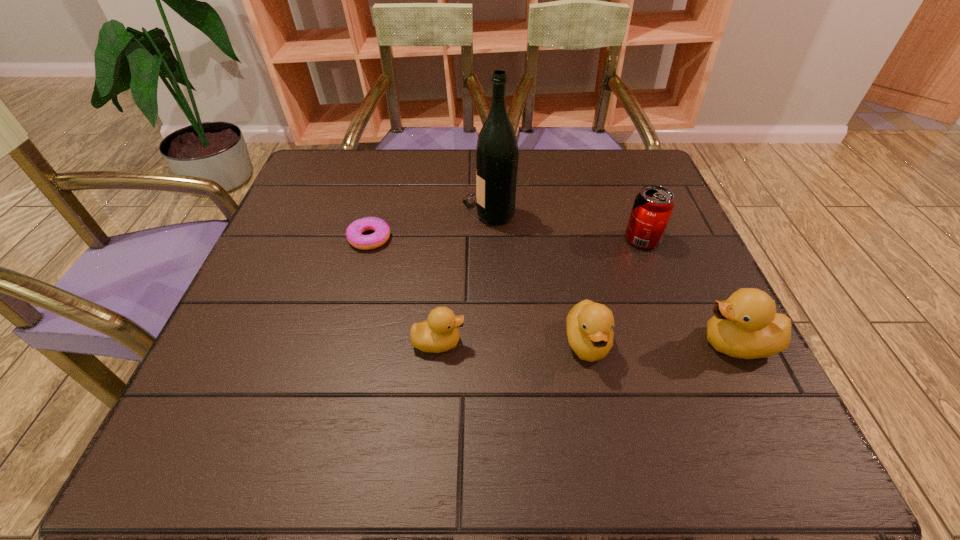
In the current image, all ducklings are evenly spaced. To maintain this equal spacing, where should an additional duckling be placed on the left? Please point out a free spot. Please provide its 2D coordinates. Your answer should be formatted as a tuple, i.e. [(x, y)], where the tuple contains the x and y coordinates of a point satisfying the conditions above.

[(290, 341)]